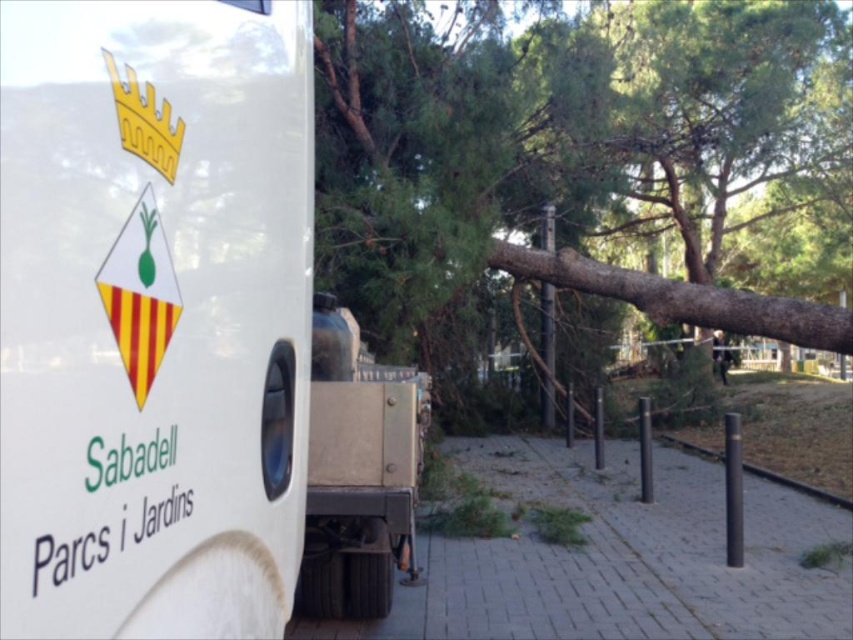
Question: Which point appears farthest from the camera in this image?

Choices:
 (A) (357, 413)
 (B) (708, 284)
 (C) (276, 323)

Answer: (B)

Question: Is white matte truck at center to the right of metallic silver truck at center from the viewer's perspective?

Choices:
 (A) yes
 (B) no

Answer: (A)

Question: Does brown rough wood at center have a smaller size compared to metallic silver truck at center?

Choices:
 (A) yes
 (B) no

Answer: (B)

Question: Which of the following is the farthest from the observer?

Choices:
 (A) brown rough wood at center
 (B) white matte truck at center

Answer: (A)

Question: Which point is farther from the camera taking this photo?

Choices:
 (A) (421, 438)
 (B) (579, 192)
 (C) (149, 44)

Answer: (B)

Question: Is white matte truck at center positioned before brown rough wood at center?

Choices:
 (A) no
 (B) yes

Answer: (B)